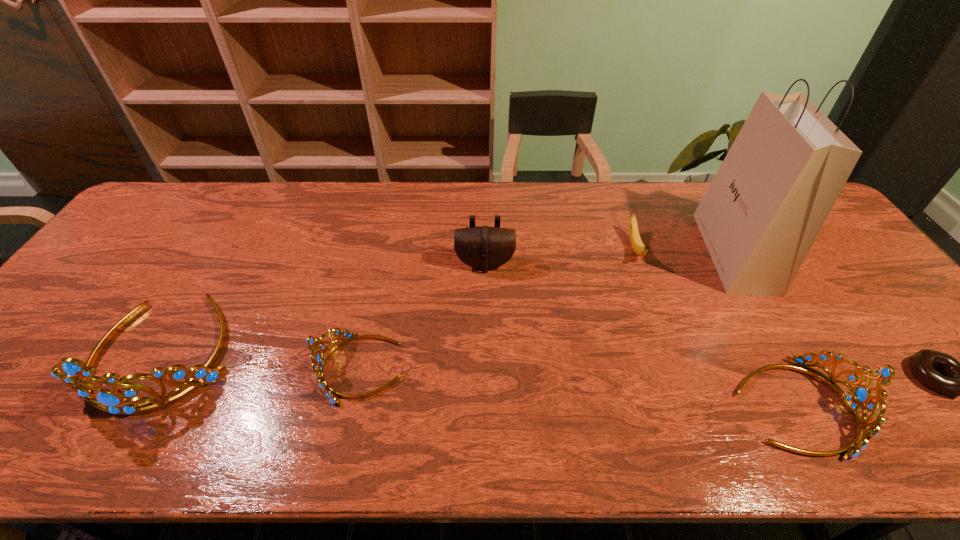
I want to click on the tallest tiara, so click(x=75, y=373).

This screenshot has height=540, width=960. I want to click on the second tallest object, so click(x=75, y=373).

Locate an element on the screen. the shortest tiara is located at coordinates (318, 362).

Locate an element on the screen. Image resolution: width=960 pixels, height=540 pixels. the second object from left to right is located at coordinates (318, 362).

Image resolution: width=960 pixels, height=540 pixels. In order to click on the rightmost tiara in this screenshot , I will do `click(861, 394)`.

Find the location of a particular element. the fourth object from left to right is located at coordinates (639, 248).

Identify the location of the second shortest object. The width and height of the screenshot is (960, 540). (639, 248).

Where is `shopping bag`? shopping bag is located at coordinates (762, 212).

Locate an element on the screen. The width and height of the screenshot is (960, 540). pouch is located at coordinates (484, 248).

At what (x,y) coordinates should I click in order to perform the action: click on vacant space located on the front-facing side of the sixth object from right to left. Please return your answer as a coordinate pair (x, y). Looking at the image, I should click on (153, 369).